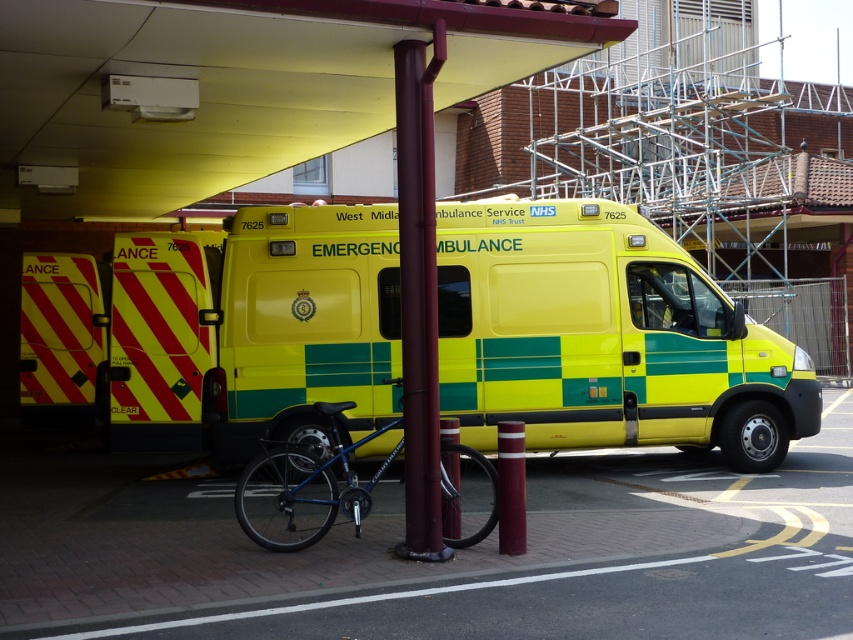
Who is more forward, (374, 262) or (410, 340)?

Point (410, 340) is in front.

Between yellow/green checkered emergency vehicle at center and maroon metallic pole at center, which one has less height?

yellow/green checkered emergency vehicle at center is shorter.

Is point (233, 305) less distant than point (428, 426)?

No, it is not.

Find the location of a particular element. This screenshot has height=640, width=853. yellow/green checkered emergency vehicle at center is located at coordinates (602, 337).

Who is lower down, maroon metallic pole at center or blue metallic bicycle at center?

Positioned lower is blue metallic bicycle at center.

Does maroon metallic pole at center lie behind blue metallic bicycle at center?

No, it is in front of blue metallic bicycle at center.

The image size is (853, 640). Describe the element at coordinates (418, 294) in the screenshot. I see `maroon metallic pole at center` at that location.

Locate an element on the screen. maroon metallic pole at center is located at coordinates (418, 294).

What do you see at coordinates (602, 337) in the screenshot? Image resolution: width=853 pixels, height=640 pixels. I see `yellow/green checkered emergency vehicle at center` at bounding box center [602, 337].

Can you confirm if yellow/green checkered emergency vehicle at center is bigger than blue metallic bicycle at center?

No, yellow/green checkered emergency vehicle at center is not bigger than blue metallic bicycle at center.

Between point (566, 307) and point (345, 403), which one is positioned in front?

Point (345, 403) is in front.

Identify the location of yellow/green checkered emergency vehicle at center. Image resolution: width=853 pixels, height=640 pixels. (602, 337).